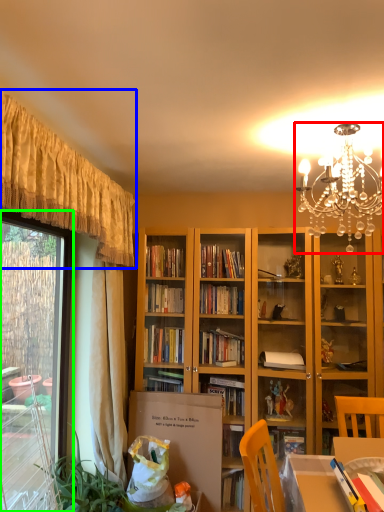
Question: Considering the real-world distances, which object is farthest from lamp (highlighted by a red box)? curtain (highlighted by a blue box) or window (highlighted by a green box)?

Choices:
 (A) curtain
 (B) window

Answer: (B)